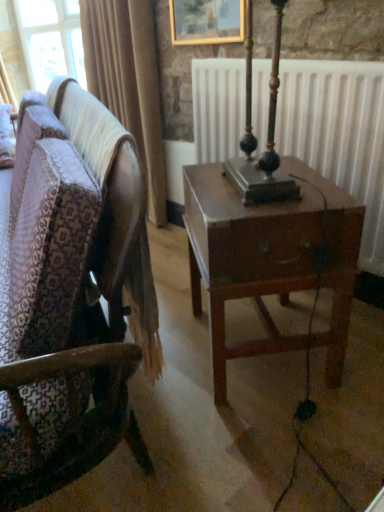
Question: Is gold-framed painting at upper center bigger or smaller than white matte radiator at center?

Choices:
 (A) small
 (B) big

Answer: (A)

Question: Considering their positions, is gold-framed painting at upper center located in front of or behind white matte radiator at center?

Choices:
 (A) front
 (B) behind

Answer: (B)

Question: Based on their relative distances, which object is nearer to the white matte radiator at center?

Choices:
 (A) wooden chair at center
 (B) gold-framed painting at upper center

Answer: (B)

Question: Which is nearer to the wooden chair at center?

Choices:
 (A) gold-framed painting at upper center
 (B) white matte radiator at center

Answer: (B)